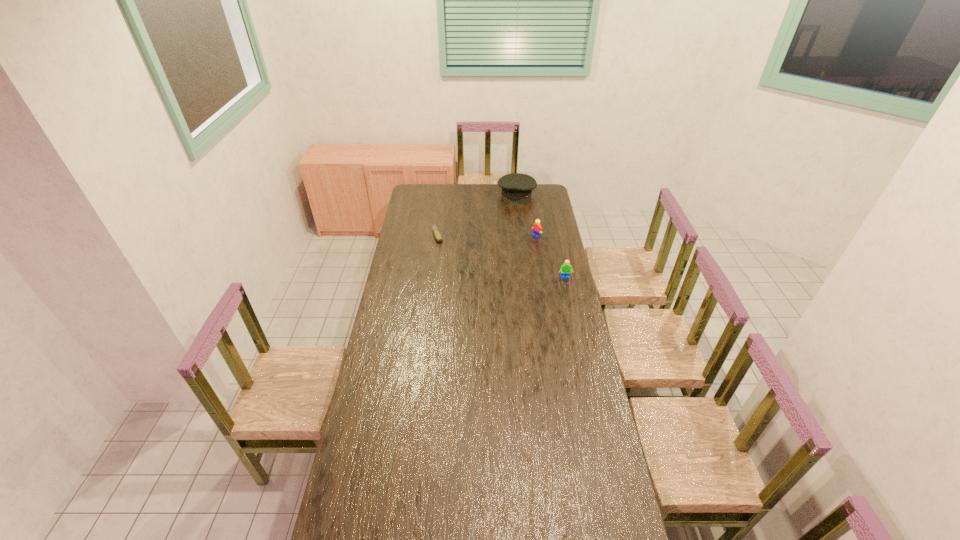
This screenshot has width=960, height=540. Identify the location of vacant area that lies between the left Lego and the rightmost object. (551, 257).

Locate which object ranks second in proximity to the left Lego. Please provide its 2D coordinates. Your answer should be formatted as a tuple, i.e. [(x, y)], where the tuple contains the x and y coordinates of a point satisfying the conditions above.

[(565, 269)]

You are a GUI agent. You are given a task and a screenshot of the screen. Output one action in this format:
    pyautogui.click(x=<x>, y=<y>)
    Task: Click on the third closest object to the farther Lego
    
    Given the screenshot: What is the action you would take?
    pyautogui.click(x=438, y=237)

Where is `vacant space that satisfies the following two spatial constraints: 1. on the back side of the beret; 2. on the right side of the leftmost object`? The image size is (960, 540). vacant space that satisfies the following two spatial constraints: 1. on the back side of the beret; 2. on the right side of the leftmost object is located at coordinates (443, 194).